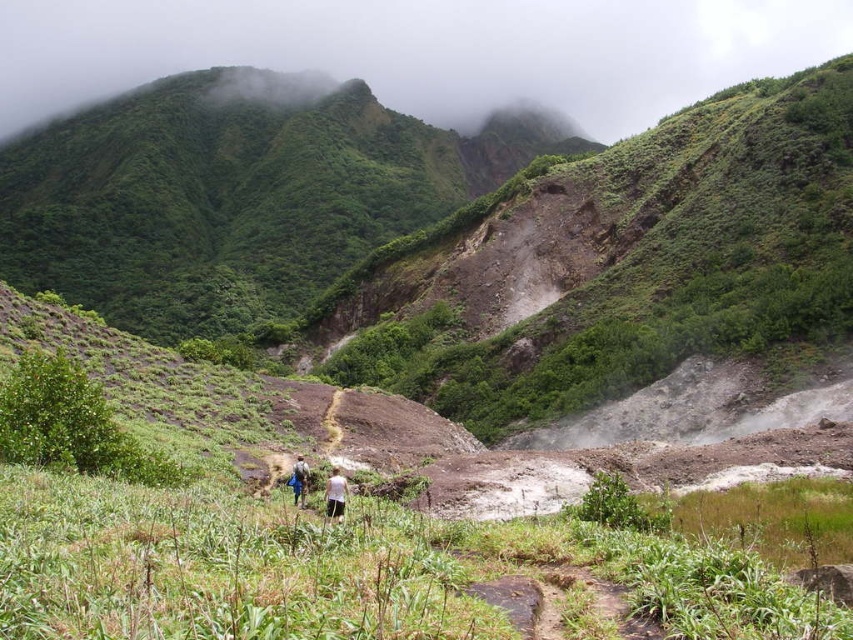
You are a hiker trying to decide whether to pack your white fabric shirt at center or your blue fabric bag at center for a trip. Given the mountainous terrain depicted in the scene, which item should you choose based on their sizes?

The white fabric shirt at center has a larger width than the blue fabric bag at center. Since the mountainous terrain requires carrying essentials, the blue fabric bag at center might be more practical for holding items, despite being smaller in width.

You are standing at the starting point of the dirt path in the foreground. There is a point marked at coordinates point (236,195). According to the image, where is this point located?

The point (236,195) is on the green grassy mountain at upper center.

You are an adventurer hiking along the dirt path in the mountainous landscape. You see a blue fabric couple at center and a white fabric shirt at center. Which one is positioned lower in the scene?

The blue fabric couple at center is located below the white fabric shirt at center, so the blue fabric couple at center is positioned lower in the scene.